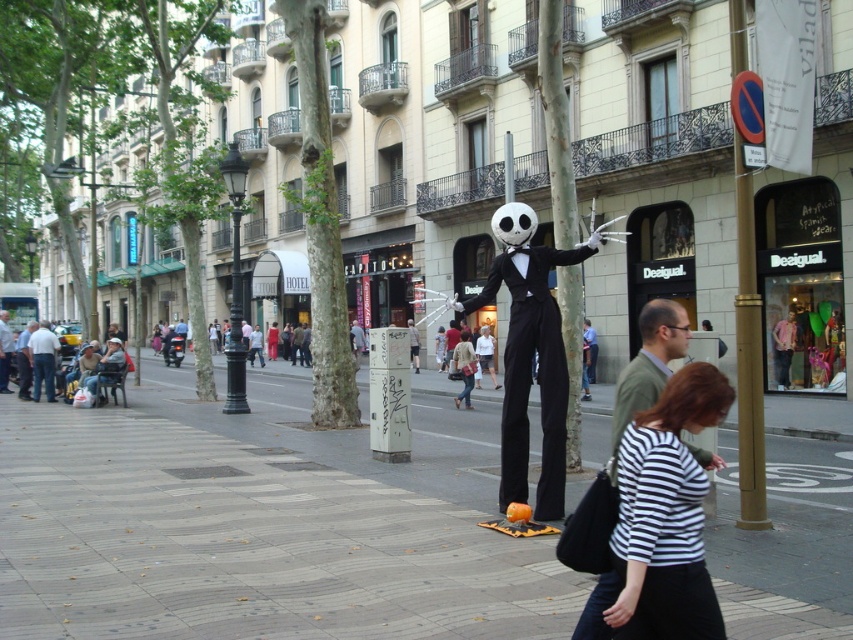
Between striped fabric shirt at lower right and gold polished pole at right, which one is positioned higher?

Positioned higher is gold polished pole at right.

Between striped fabric shirt at lower right and gold polished pole at right, which one appears on the right side from the viewer's perspective?

gold polished pole at right is more to the right.

This screenshot has height=640, width=853. I want to click on striped fabric shirt at lower right, so click(x=663, y=516).

Does smooth concrete sidewalk at center have a lesser height compared to striped fabric shirt at lower right?

Yes, smooth concrete sidewalk at center is shorter than striped fabric shirt at lower right.

Who is taller, smooth concrete sidewalk at center or striped fabric shirt at lower right?

striped fabric shirt at lower right is taller.

This screenshot has height=640, width=853. What are the coordinates of `smooth concrete sidewalk at center` in the screenshot? It's located at (260, 525).

This screenshot has width=853, height=640. Identify the location of smooth concrete sidewalk at center. (260, 525).

Can you confirm if smooth concrete sidewalk at center is positioned below gold polished pole at right?

Indeed, smooth concrete sidewalk at center is positioned under gold polished pole at right.

Can you confirm if smooth concrete sidewalk at center is bigger than gold polished pole at right?

Correct, smooth concrete sidewalk at center is larger in size than gold polished pole at right.

Image resolution: width=853 pixels, height=640 pixels. What do you see at coordinates (260, 525) in the screenshot?
I see `smooth concrete sidewalk at center` at bounding box center [260, 525].

At what (x,y) coordinates should I click in order to perform the action: click on smooth concrete sidewalk at center. Please return your answer as a coordinate pair (x, y). The image size is (853, 640). Looking at the image, I should click on (260, 525).